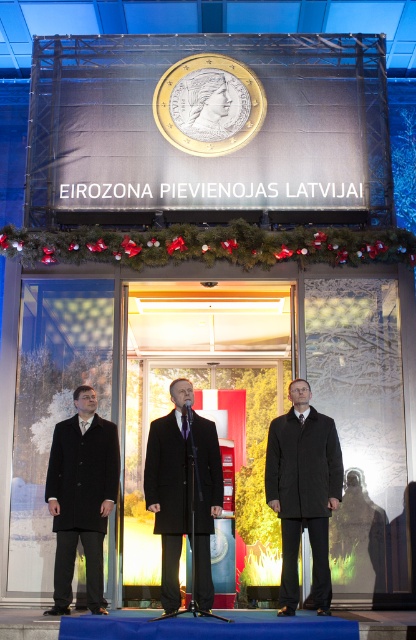
Does dark gray wool coat at center appear on the right side of matte black coat at left?

Correct, you'll find dark gray wool coat at center to the right of matte black coat at left.

Who is more distant from viewer, (301, 470) or (71, 563)?

The point (301, 470) is behind.

This screenshot has height=640, width=416. Find the location of `dark gray wool coat at center`. dark gray wool coat at center is located at coordinates (304, 492).

Is dark gray wool coat at center smaller than black matte suit at center?

Incorrect, dark gray wool coat at center is not smaller in size than black matte suit at center.

You are a GUI agent. You are given a task and a screenshot of the screen. Output one action in this format:
    pyautogui.click(x=<x>, y=<y>)
    Task: Click on the dark gray wool coat at center
    
    Given the screenshot: What is the action you would take?
    pyautogui.click(x=304, y=492)

Is matte black coat at left above black matte suit at center?

No.

Does matte black coat at left have a greater width compared to black matte suit at center?

In fact, matte black coat at left might be narrower than black matte suit at center.

Does point (66, 433) come in front of point (197, 413)?

That is True.

What are the coordinates of `matte black coat at left` in the screenshot? It's located at (81, 497).